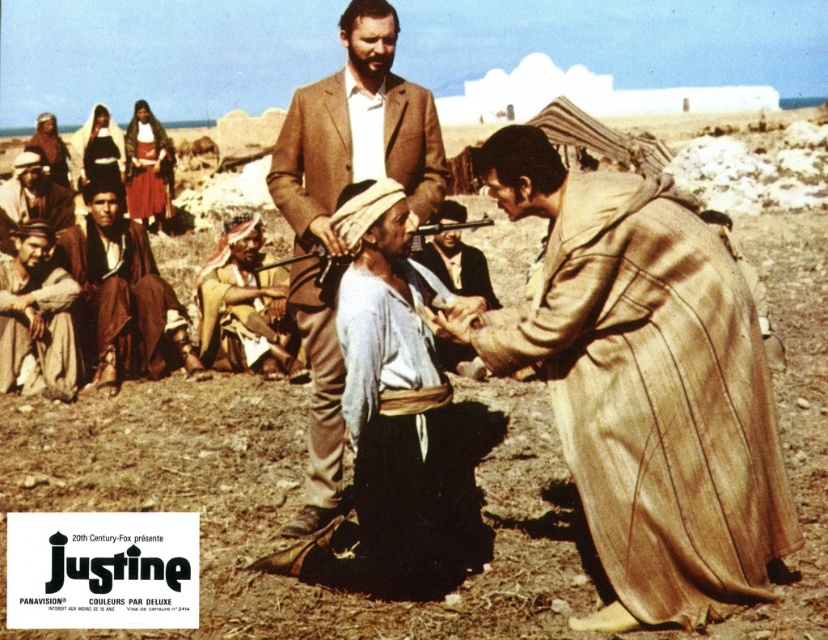
Does light blue fabric at center appear on the right side of yellow fabric headscarf at center?

Indeed, light blue fabric at center is positioned on the right side of yellow fabric headscarf at center.

Between light blue fabric at center and yellow fabric headscarf at center, which one appears on the left side from the viewer's perspective?

yellow fabric headscarf at center is more to the left.

Where is `light blue fabric at center`? The image size is (828, 640). light blue fabric at center is located at coordinates (395, 412).

Locate an element on the screen. This screenshot has width=828, height=640. light blue fabric at center is located at coordinates (395, 412).

Which is in front, point (321, 173) or point (46, 204)?

Positioned in front is point (321, 173).

Does brown woolen suit at center have a larger size compared to brown leather hat at lower left?

Incorrect, brown woolen suit at center is not larger than brown leather hat at lower left.

Find the location of `brown woolen suit at center`. brown woolen suit at center is located at coordinates (355, 132).

Where is `brown woolen suit at center`? This screenshot has height=640, width=828. brown woolen suit at center is located at coordinates (355, 132).

Who is positioned more to the left, brown leather robe at lower left or smooth leather gun at center?

Positioned to the left is brown leather robe at lower left.

Which is more to the right, brown leather robe at lower left or smooth leather gun at center?

smooth leather gun at center is more to the right.

Who is more distant from viewer, (13, 381) or (485, 288)?

Positioned behind is point (485, 288).

You are a GUI agent. You are given a task and a screenshot of the screen. Output one action in this format:
    pyautogui.click(x=<x>, y=<y>)
    Task: Click on the brown leather robe at lower left
    The image size is (828, 640).
    Given the screenshot: What is the action you would take?
    pyautogui.click(x=36, y=317)